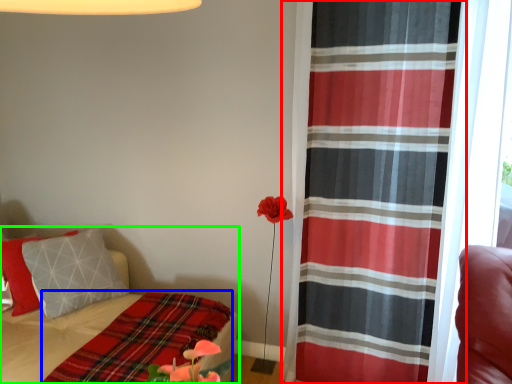
Question: Which object is the closest to the curtain (highlighted by a red box)? Choose among these: blanket (highlighted by a blue box) or bed (highlighted by a green box).

Choices:
 (A) blanket
 (B) bed

Answer: (A)